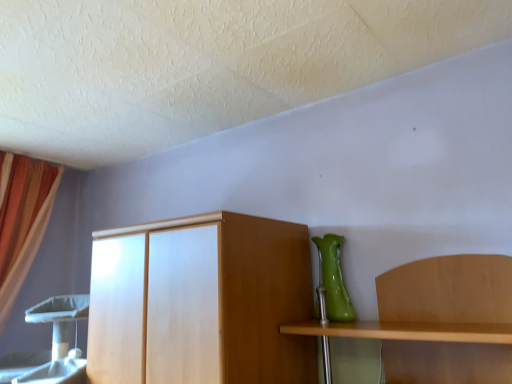
Question: Can you confirm if green glossy vase at right is taller than orange fabric curtain at left?

Choices:
 (A) yes
 (B) no

Answer: (B)

Question: From a real-world perspective, is green glossy vase at right located higher than orange fabric curtain at left?

Choices:
 (A) no
 (B) yes

Answer: (A)

Question: Is green glossy vase at right smaller than orange fabric curtain at left?

Choices:
 (A) no
 (B) yes

Answer: (B)

Question: Considering the relative positions of green glossy vase at right and orange fabric curtain at left in the image provided, is green glossy vase at right to the left of orange fabric curtain at left from the viewer's perspective?

Choices:
 (A) no
 (B) yes

Answer: (A)

Question: Can you confirm if green glossy vase at right is thinner than orange fabric curtain at left?

Choices:
 (A) no
 (B) yes

Answer: (B)

Question: From a real-world perspective, is green glossy vase at right positioned under orange fabric curtain at left based on gravity?

Choices:
 (A) no
 (B) yes

Answer: (B)

Question: Is orange fabric curtain at left outside green glossy vase at right?

Choices:
 (A) yes
 (B) no

Answer: (A)

Question: Could you tell me if orange fabric curtain at left is facing green glossy vase at right?

Choices:
 (A) no
 (B) yes

Answer: (B)

Question: Is orange fabric curtain at left to the left of green glossy vase at right from the viewer's perspective?

Choices:
 (A) no
 (B) yes

Answer: (B)

Question: Is orange fabric curtain at left positioned with its back to green glossy vase at right?

Choices:
 (A) yes
 (B) no

Answer: (B)

Question: Is the depth of orange fabric curtain at left less than that of green glossy vase at right?

Choices:
 (A) yes
 (B) no

Answer: (B)

Question: Can you confirm if orange fabric curtain at left is thinner than green glossy vase at right?

Choices:
 (A) yes
 (B) no

Answer: (B)

Question: Based on their sizes in the image, would you say orange fabric curtain at left is bigger or smaller than green glossy vase at right?

Choices:
 (A) big
 (B) small

Answer: (A)